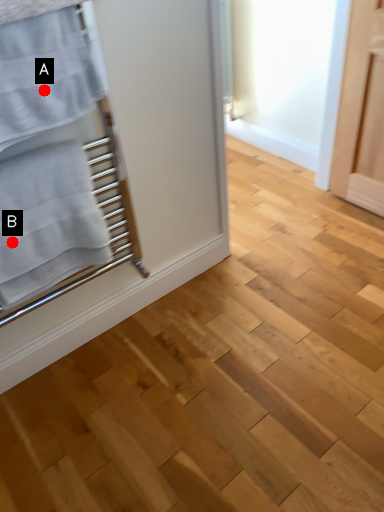
Question: Two points are circled on the image, labeled by A and B beside each circle. Which of the following is the closest to the observer?

Choices:
 (A) A is closer
 (B) B is closer

Answer: (A)